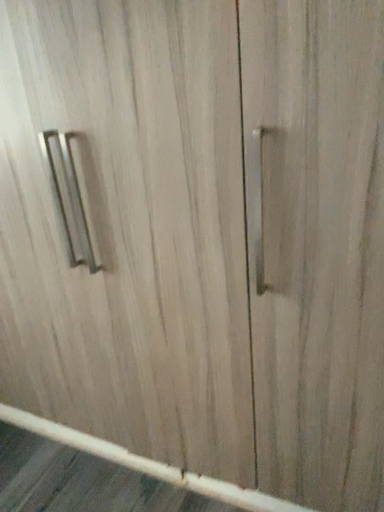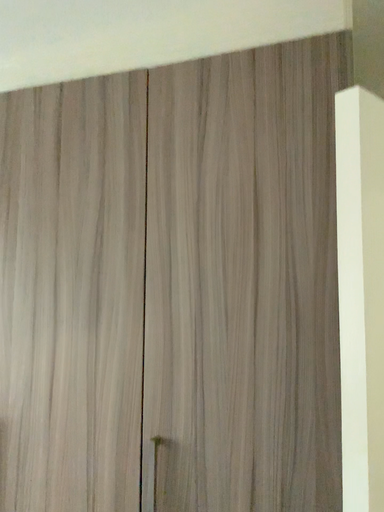
Question: How did the camera likely rotate when shooting the video?

Choices:
 (A) rotated left
 (B) rotated right

Answer: (B)